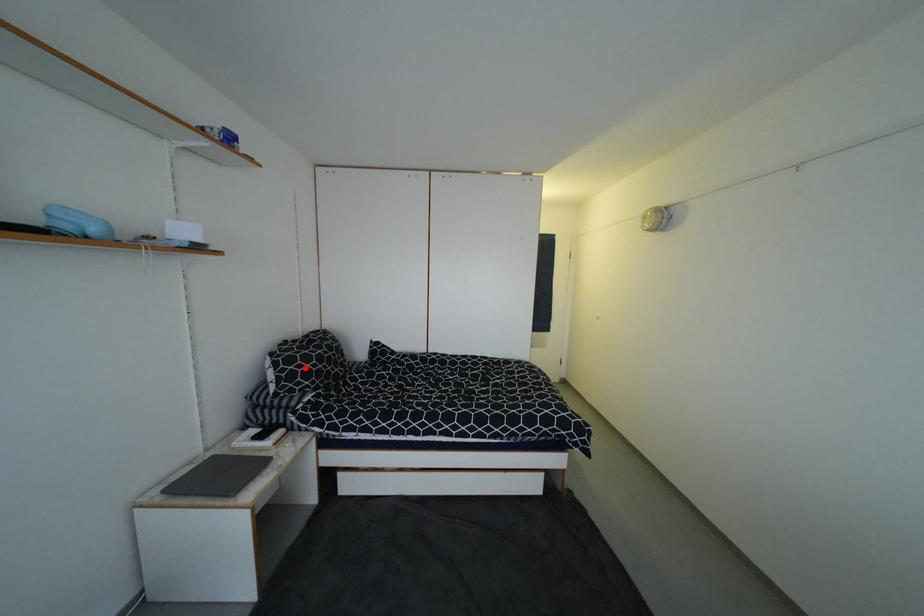
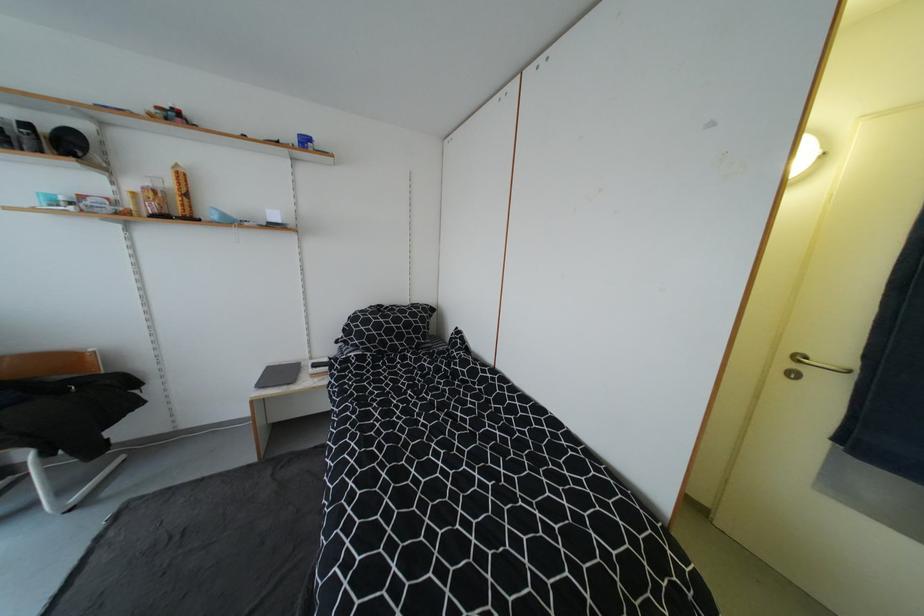
Locate, in the second image, the point that corresponds to the highlighted location in the first image.

(362, 328)